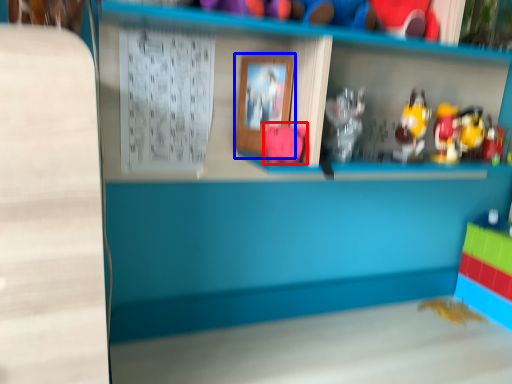
Question: Which of the following is the closest to the observer, toy (highlighted by a red box) or picture frame (highlighted by a blue box)?

Choices:
 (A) toy
 (B) picture frame

Answer: (A)